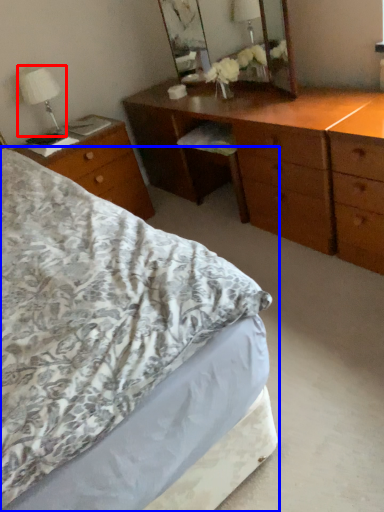
Question: Which point is closer to the camera, bedside lamp (highlighted by a red box) or bed (highlighted by a blue box)?

Choices:
 (A) bedside lamp
 (B) bed

Answer: (B)